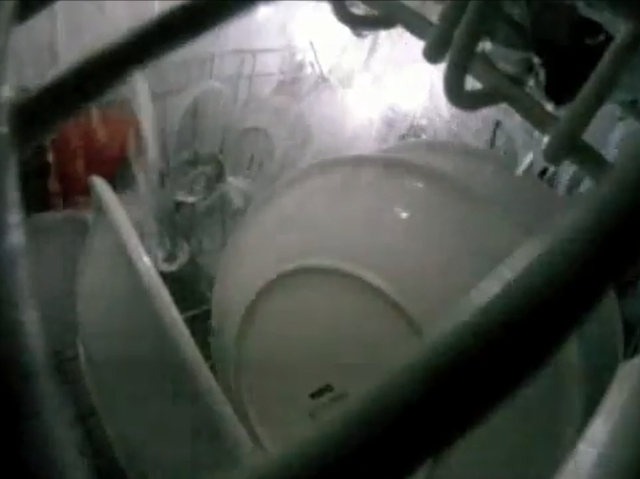
Locate an element on the screen. The image size is (640, 479). sideways glass cup is located at coordinates (196, 171).